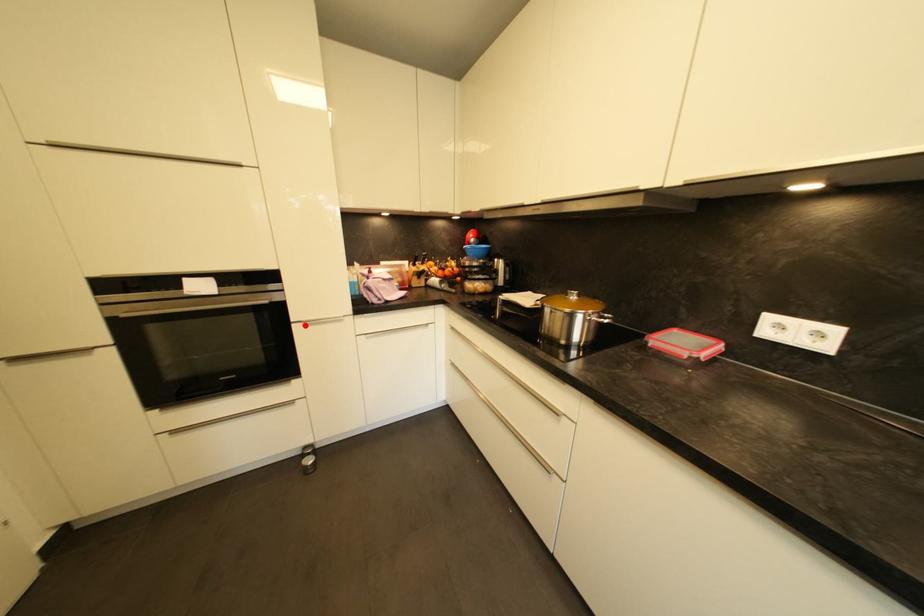
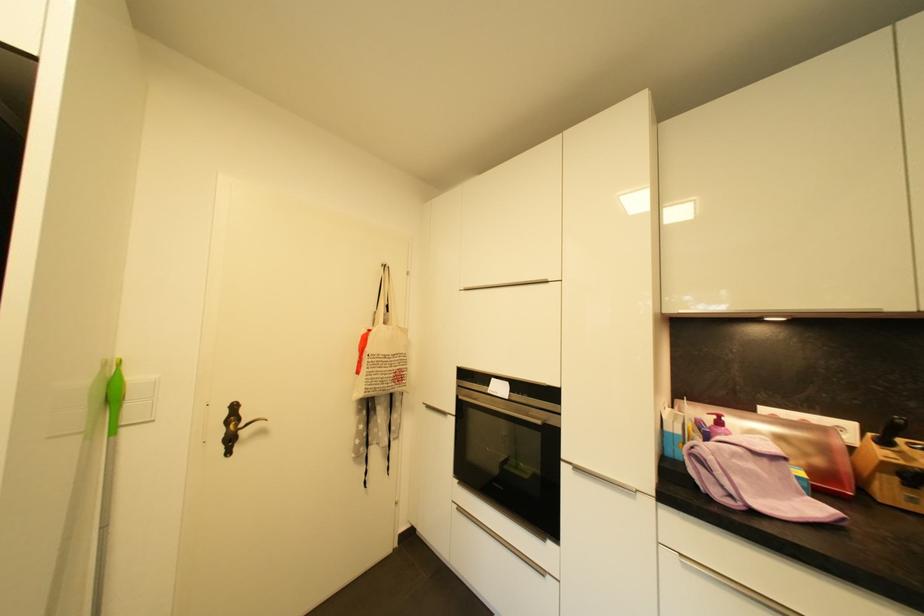
The point at the highlighted location is marked in the first image. Where is the corresponding point in the second image?

(576, 469)